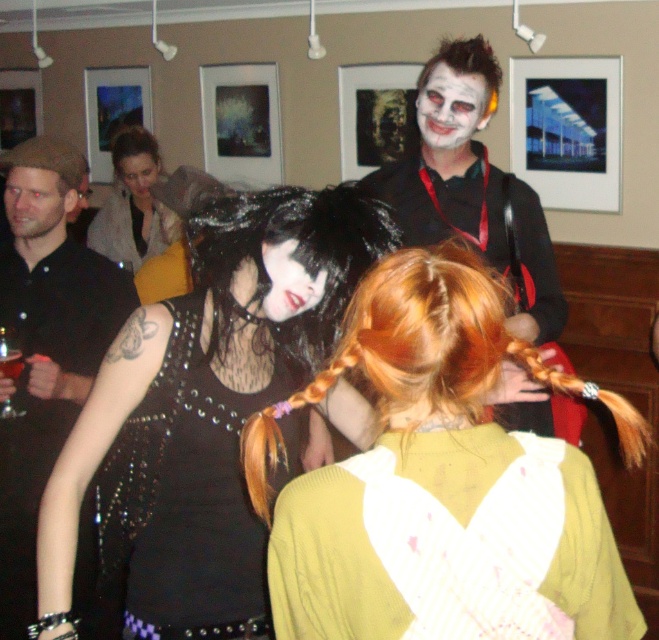
You are a photographer at the event and want to frame a photo that includes both the matte black vest at center and the white matte face at upper center. Which object should you position closer to the edge of the frame to ensure both fit within the shot?

The white matte face at upper center has a narrower width compared to the matte black vest at center. Positioning the white matte face at upper center closer to the edge would allow both objects to fit within the frame since it requires less space.

You are standing in the room and want to take a photo of both the point at coordinates point [121,547] and point [30,177]. Which point should you focus on first to ensure both are in focus?

You should focus on point [30,177] first because it is farther from the camera than point [121,547]. By focusing on the farther point, both points will be in focus due to the depth of field.